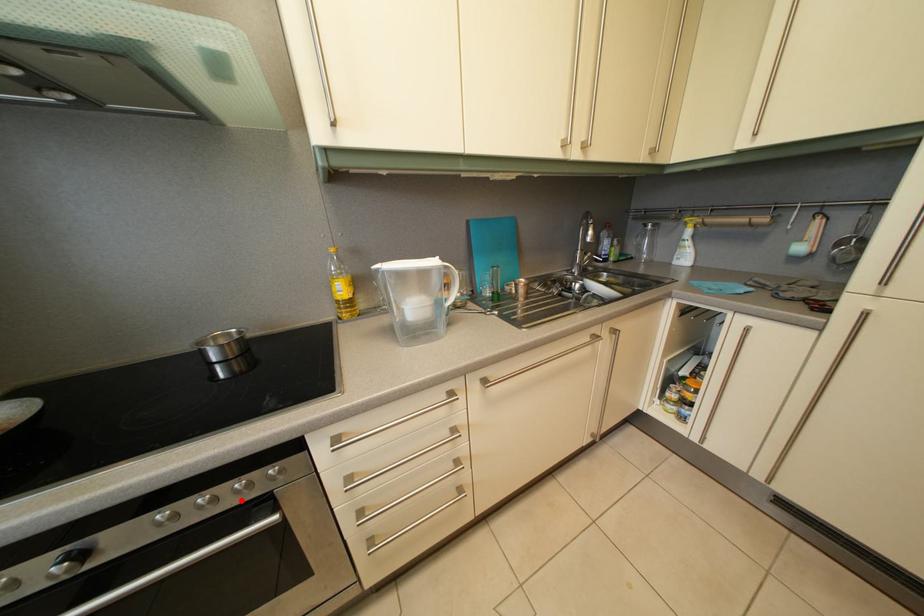
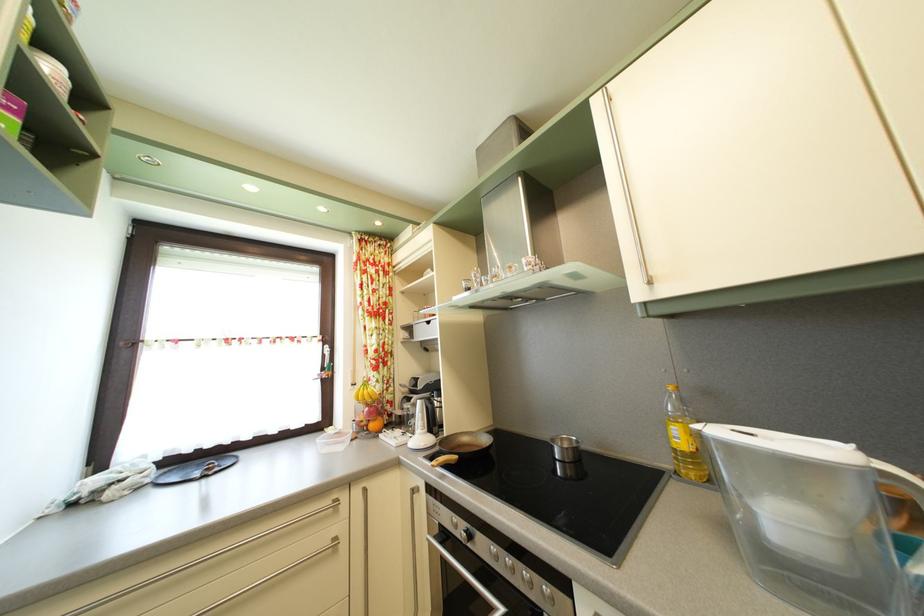
The point at the highlighted location is marked in the first image. Where is the corresponding point in the second image?

(529, 584)